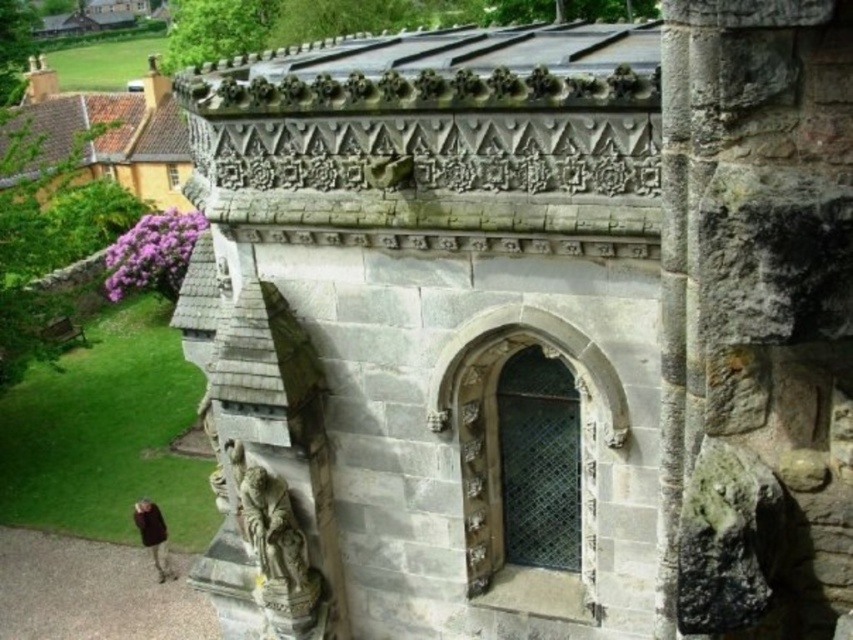
Question: Which object appears farthest from the camera in this image?

Choices:
 (A) brown leather jacket at lower left
 (B) gray stone pillar at center

Answer: (A)

Question: In this image, where is gray stone pillar at center located relative to brown leather jacket at lower left?

Choices:
 (A) right
 (B) left

Answer: (A)

Question: Which of the following is the closest to the observer?

Choices:
 (A) brown leather jacket at lower left
 (B) gray stone pillar at center

Answer: (B)

Question: Can you confirm if gray stone pillar at center is thinner than brown leather jacket at lower left?

Choices:
 (A) no
 (B) yes

Answer: (A)

Question: Does gray stone pillar at center appear on the left side of brown leather jacket at lower left?

Choices:
 (A) no
 (B) yes

Answer: (A)